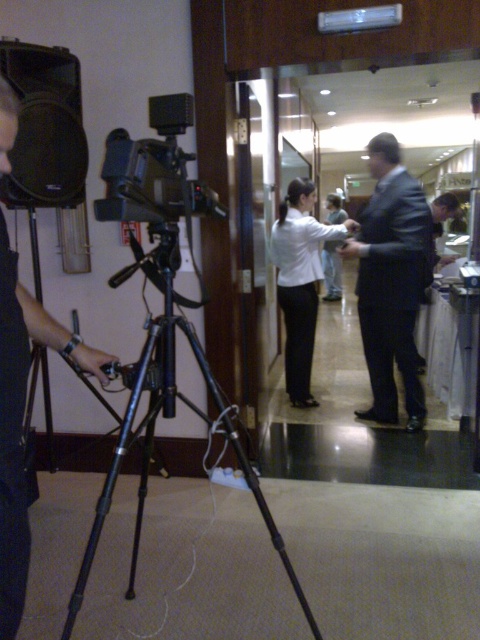
Question: Can you confirm if black metal tripod at lower left is positioned below white shirt at center?

Choices:
 (A) no
 (B) yes

Answer: (B)

Question: Which object is farther from the camera taking this photo?

Choices:
 (A) dark suit at center
 (B) black metal tripod at lower left
 (C) white matte shirt at center
 (D) white shirt at center

Answer: (D)

Question: Can you confirm if black metal tripod at lower left is positioned above white shirt at center?

Choices:
 (A) yes
 (B) no

Answer: (B)

Question: Which of the following is the closest to the observer?

Choices:
 (A) (144, 428)
 (B) (312, 296)
 (C) (332, 276)
 (D) (416, 422)

Answer: (A)

Question: Among these points, which one is farthest from the camera?

Choices:
 (A) (287, 218)
 (B) (384, 394)
 (C) (339, 220)
 (D) (112, 476)

Answer: (C)

Question: Can you confirm if dark suit at center is thinner than black metal tripod at lower left?

Choices:
 (A) yes
 (B) no

Answer: (A)